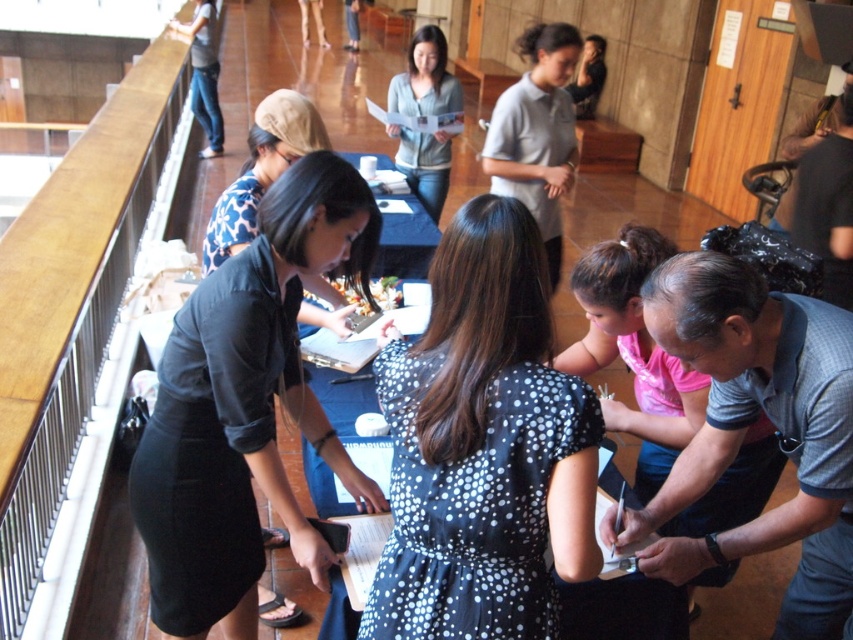
You are standing at the entrance of the room and want to hand a document to the person wearing the white uniform shirt at center without disturbing the person in the matte black dress at center. Is there enough space between them to walk through?

The matte black dress at center is in front of the white uniform shirt at center, so there might not be enough space to walk between them without getting close to the matte black dress at center.

You are a delivery person carrying a package that requires a 10 feet clearance to pass through a narrow hallway. You see the black dotted dress at center and the light blue knit sweater at center in the scene. Can you safely navigate through the space between them with your package?

→ The distance between the black dotted dress at center and the light blue knit sweater at center is 11.02 feet, which is greater than the required 10 feet clearance. Therefore, you can safely navigate through the space between them with your package.

You are a photographer trying to capture the black dotted dress at center and the matte black dress at center in the same frame. Since both dresses are at the center, can you determine which one is closer to the camera?

The black dotted dress at center is located above the matte black dress at center, so it is closer to the camera.